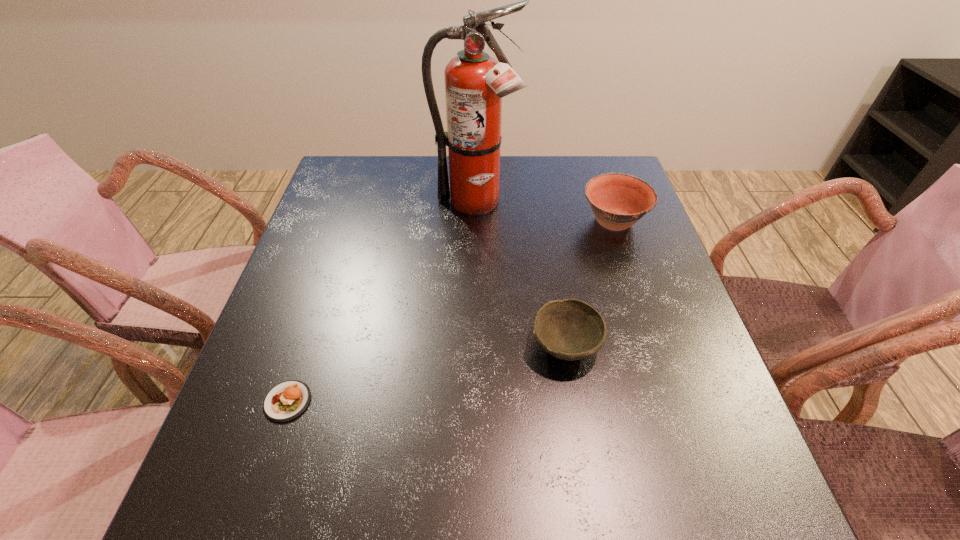
You are a GUI agent. You are given a task and a screenshot of the screen. Output one action in this format:
    pyautogui.click(x=<x>, y=<y>)
    Task: Click on the vacant point at the right edge
    The height and width of the screenshot is (540, 960).
    Given the screenshot: What is the action you would take?
    pyautogui.click(x=661, y=353)

Where is `vacant position at the far left corner of the desktop`? vacant position at the far left corner of the desktop is located at coordinates (372, 174).

In the image, there is a desktop. Identify the location of free space at the near right corner. This screenshot has height=540, width=960. (772, 515).

In order to click on free spot between the leftmost object and the taller bowl in this screenshot , I will do `click(450, 312)`.

The width and height of the screenshot is (960, 540). I want to click on unoccupied position between the shorter bowl and the patty (food), so click(x=426, y=374).

You are a GUI agent. You are given a task and a screenshot of the screen. Output one action in this format:
    pyautogui.click(x=<x>, y=<y>)
    Task: Click on the free space between the second tallest object and the shorter bowl
    This screenshot has height=540, width=960.
    Given the screenshot: What is the action you would take?
    pyautogui.click(x=589, y=284)

The width and height of the screenshot is (960, 540). I want to click on free space between the left bowl and the nearest object, so click(426, 374).

Locate an element on the screen. The width and height of the screenshot is (960, 540). free space that is in between the fire extinguisher and the shortest object is located at coordinates (381, 303).

At what (x,y) coordinates should I click in order to perform the action: click on vacant area that lies between the rightmost object and the second object from left to right. Please return your answer as a coordinate pair (x, y). Looking at the image, I should click on (544, 213).

You are a GUI agent. You are given a task and a screenshot of the screen. Output one action in this format:
    pyautogui.click(x=<x>, y=<y>)
    Task: Click on the blank region between the second nearest object and the second object from left to right
    Image resolution: width=960 pixels, height=540 pixels.
    Given the screenshot: What is the action you would take?
    pyautogui.click(x=520, y=275)